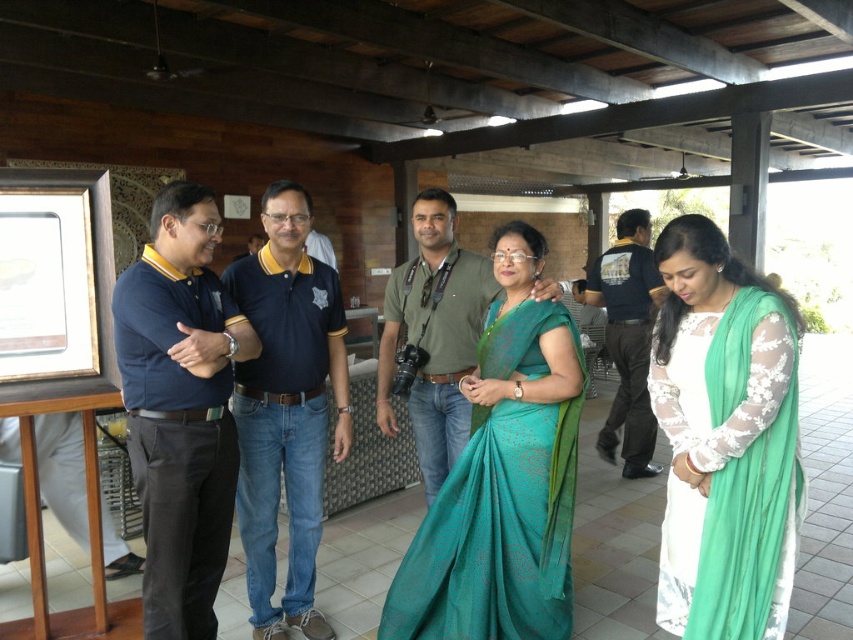
Question: Which object is positioned farthest from the matte blue shirt at left?

Choices:
 (A) teal silk saree at center
 (B) dark blue shirt at center
 (C) dark blue polo shirt at center

Answer: (B)

Question: Among these objects, which one is farthest from the camera?

Choices:
 (A) white lace dress at lower right
 (B) matte blue shirt at left
 (C) teal silk saree at center

Answer: (C)

Question: Is teal silk saree at center bigger than matte blue shirt at left?

Choices:
 (A) yes
 (B) no

Answer: (A)

Question: Does matte blue shirt at left have a lesser width compared to dark blue polo shirt at center?

Choices:
 (A) yes
 (B) no

Answer: (A)

Question: Estimate the real-world distances between objects in this image. Which object is closer to the teal silk saree at center?

Choices:
 (A) dark blue polo shirt at center
 (B) dark blue shirt at center
 (C) matte blue shirt at left
 (D) white lace dress at lower right

Answer: (D)

Question: Does teal silk saree at center have a smaller size compared to dark blue polo shirt at center?

Choices:
 (A) yes
 (B) no

Answer: (B)